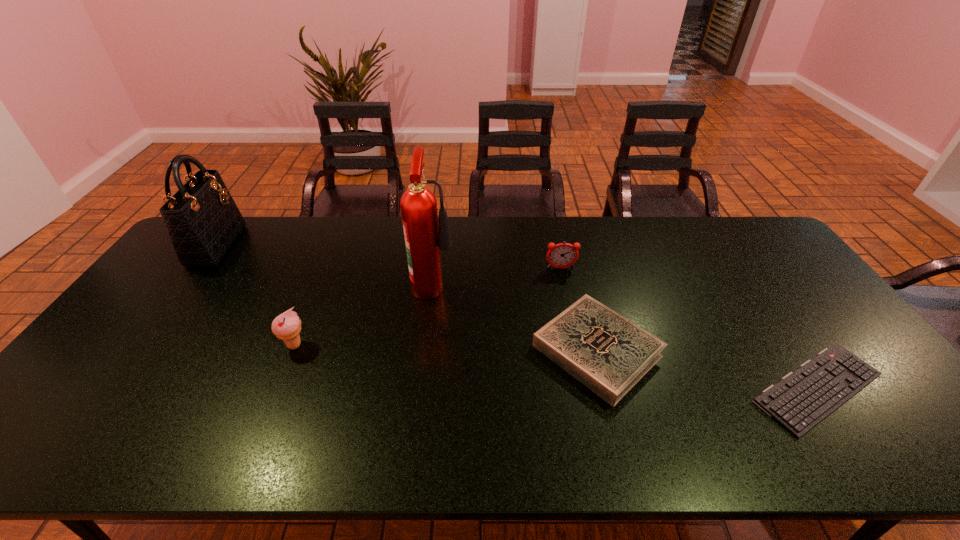
At what (x,y) coordinates should I click in order to perform the action: click on free spot that satisfies the following two spatial constraints: 1. on the front-facing side of the hardback book; 2. on the right side of the fourth tallest object. Please return your answer as a coordinate pair (x, y). Image resolution: width=960 pixels, height=540 pixels. Looking at the image, I should click on (578, 350).

The width and height of the screenshot is (960, 540). Identify the location of vacant region that satisfies the following two spatial constraints: 1. at the front of the hardback book with visible charms; 2. on the right side of the second tallest object. (138, 350).